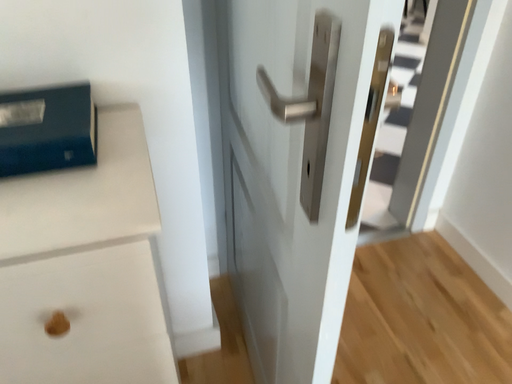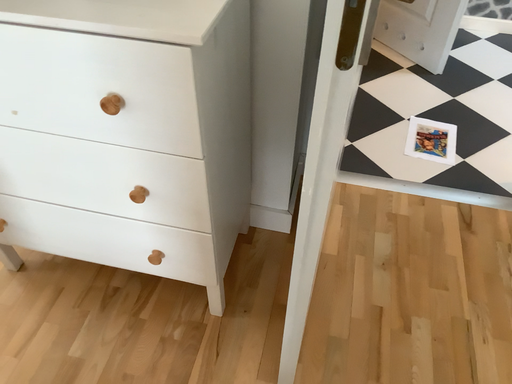
Question: How did the camera likely rotate when shooting the video?

Choices:
 (A) rotated left
 (B) rotated right

Answer: (A)